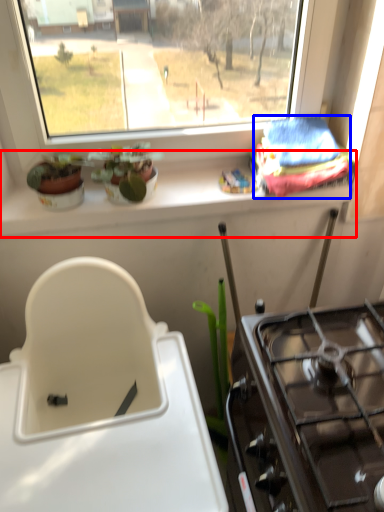
Question: Which of the following is the closest to the observer, window sill (highlighted by a red box) or material (highlighted by a blue box)?

Choices:
 (A) window sill
 (B) material

Answer: (B)